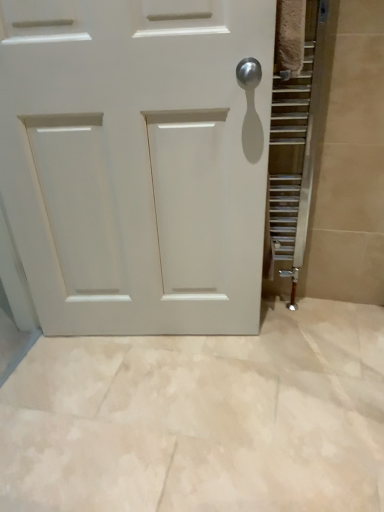
What are the coordinates of `vacant area that lies to the right of white matte door at center` in the screenshot? It's located at (298, 360).